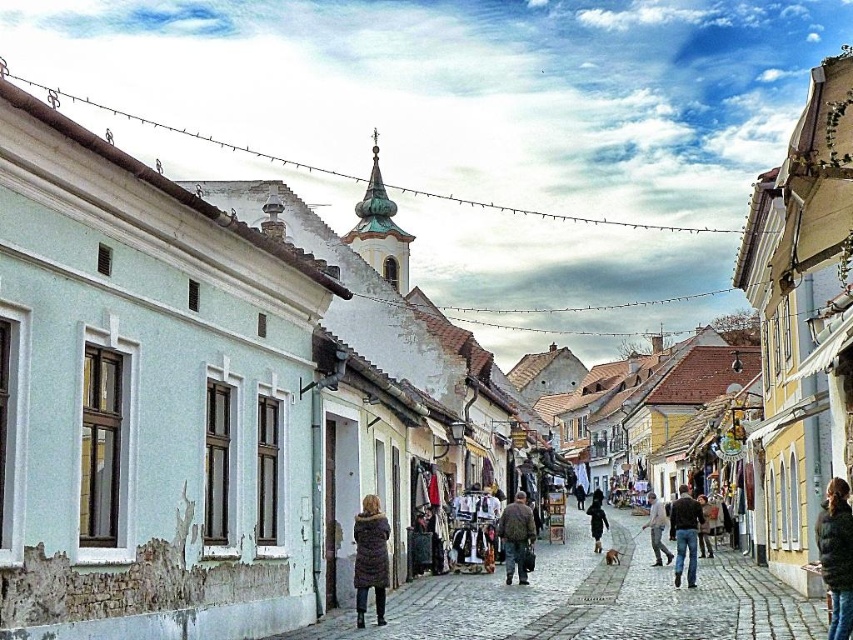
Question: Which object appears closest to the camera in this image?

Choices:
 (A) jeans at center
 (B) black fuzzy jacket at lower right
 (C) dark brown leather coat at center
 (D) brown fuzzy coat at center

Answer: (B)

Question: Which point is closer to the camera?

Choices:
 (A) dark brown fur-trimmed coat at center
 (B) jeans at center

Answer: (A)

Question: Which point is closer to the camera?

Choices:
 (A) brown fuzzy coat at center
 (B) camouflage jacket at center
 (C) matte white wall at center
 (D) jeans at center

Answer: (C)

Question: Can you confirm if jeans at center is positioned below dark brown leather jacket at center?

Choices:
 (A) yes
 (B) no

Answer: (B)

Question: Is dark brown leather jacket at center to the left of brown fuzzy coat at center from the viewer's perspective?

Choices:
 (A) no
 (B) yes

Answer: (A)

Question: Can you confirm if black fuzzy jacket at lower right is positioned to the right of dark brown leather jacket at center?

Choices:
 (A) no
 (B) yes

Answer: (A)